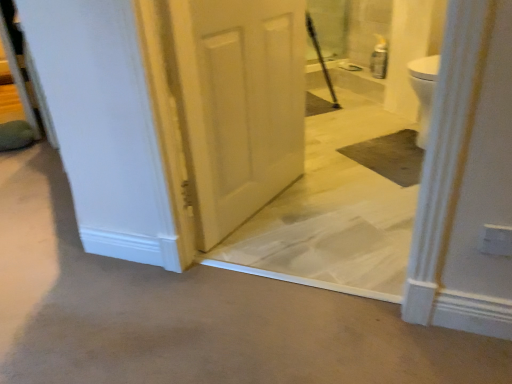
Identify the location of white matte door at center. (240, 104).

Describe the element at coordinates (240, 104) in the screenshot. This screenshot has height=384, width=512. I see `white matte door at center` at that location.

Measure the distance between point [302,57] and camera.

They are 6.28 feet apart.

This screenshot has width=512, height=384. What do you see at coordinates (191, 313) in the screenshot?
I see `white glossy concrete at center` at bounding box center [191, 313].

Measure the distance between white glossy concrete at center and camera.

white glossy concrete at center is 3.61 feet from camera.

You are a GUI agent. You are given a task and a screenshot of the screen. Output one action in this format:
    pyautogui.click(x=<x>, y=<y>)
    Task: Click on the white glossy concrete at center
    
    Given the screenshot: What is the action you would take?
    pyautogui.click(x=191, y=313)

Locate an element on the screen. white matte door at center is located at coordinates (240, 104).

Is white matte door at center to the left or to the right of white glossy concrete at center in the image?

Clearly, white matte door at center is on the right of white glossy concrete at center in the image.

Which object is further away from the camera taking this photo, white matte door at center or white glossy concrete at center?

white matte door at center is further from the camera.

Which is behind, point (214, 236) or point (105, 279)?

The point (214, 236) is behind.

From the image's perspective, relative to white glossy concrete at center, is white matte door at center above or below?

white matte door at center is situated higher than white glossy concrete at center in the image.

From a real-world perspective, which object rests below the other?

In real-world perspective, white glossy concrete at center is lower.

Does white matte door at center have a greater width compared to white glossy concrete at center?

Incorrect, the width of white matte door at center does not surpass that of white glossy concrete at center.

Can you confirm if white matte door at center is taller than white glossy concrete at center?

Correct, white matte door at center is much taller as white glossy concrete at center.

Considering the relative sizes of white matte door at center and white glossy concrete at center in the image provided, is white matte door at center smaller than white glossy concrete at center?

Indeed, white matte door at center has a smaller size compared to white glossy concrete at center.

Is white matte door at center outside of white glossy concrete at center?

Absolutely, white matte door at center is external to white glossy concrete at center.

Is white matte door at center directly adjacent to white glossy concrete at center?

No.

Does white matte door at center turn towards white glossy concrete at center?

No, white matte door at center does not turn towards white glossy concrete at center.

This screenshot has height=384, width=512. In order to click on door on the right of white glossy concrete at center in this screenshot , I will do `click(240, 104)`.

Is white glossy concrete at center to the left or to the right of white matte door at center in the image?

In the image, white glossy concrete at center appears on the left side of white matte door at center.

Does white glossy concrete at center lie behind white matte door at center?

No, the depth of white glossy concrete at center is less than that of white matte door at center.

Which is nearer, (398, 379) or (251, 149)?

Point (398, 379)

From the image's perspective, is white glossy concrete at center beneath white matte door at center?

Yes, from the image's perspective, white glossy concrete at center is below white matte door at center.

From a real-world perspective, is white glossy concrete at center physically located above or below white matte door at center?

white glossy concrete at center is situated lower than white matte door at center in the real world.

Considering the sizes of white glossy concrete at center and white matte door at center in the image, is white glossy concrete at center wider or thinner than white matte door at center?

Considering their sizes, white glossy concrete at center looks broader than white matte door at center.

Consider the image. Does white glossy concrete at center have a lesser height compared to white matte door at center?

Indeed, white glossy concrete at center has a lesser height compared to white matte door at center.

Looking at this image, between white glossy concrete at center and white matte door at center, which one has smaller size?

With smaller size is white matte door at center.

Does white glossy concrete at center contain white matte door at center?

No, white matte door at center is not inside white glossy concrete at center.

Does white glossy concrete at center touch white matte door at center?

No, white glossy concrete at center is not next to white matte door at center.

Is white glossy concrete at center looking in the opposite direction of white matte door at center?

Absolutely, white glossy concrete at center is directed away from white matte door at center.

What's the angular difference between white glossy concrete at center and white matte door at center's facing directions?

150 degrees separate the facing orientations of white glossy concrete at center and white matte door at center.

I want to click on concrete that appears in front of the white matte door at center, so click(x=191, y=313).

In order to click on concrete that is on the left side of white matte door at center in this screenshot , I will do `click(191, 313)`.

Locate an element on the screen. This screenshot has width=512, height=384. concrete lying in front of the white matte door at center is located at coordinates (191, 313).